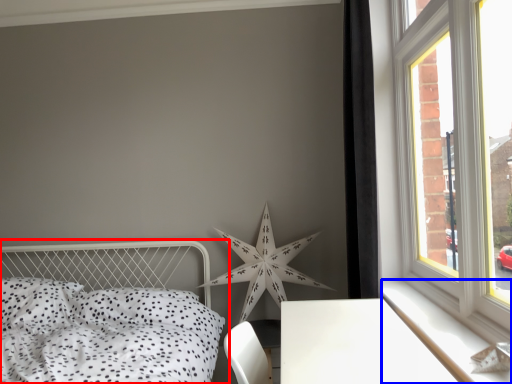
Question: Among these objects, which one is farthest to the camera, bed (highlighted by a red box) or window sill (highlighted by a blue box)?

Choices:
 (A) bed
 (B) window sill

Answer: (B)